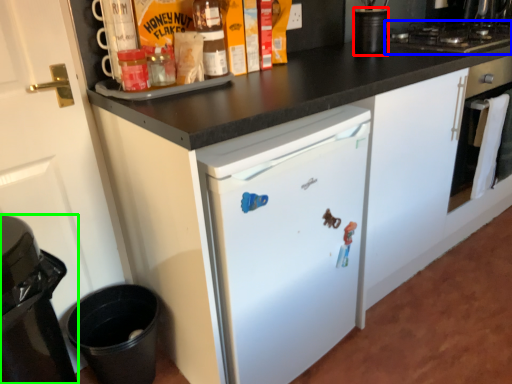
Question: Which object is positioned farthest from appliance (highlighted by a red box)? Select from gas stove (highlighted by a blue box) and home appliance (highlighted by a green box).

Choices:
 (A) gas stove
 (B) home appliance

Answer: (B)